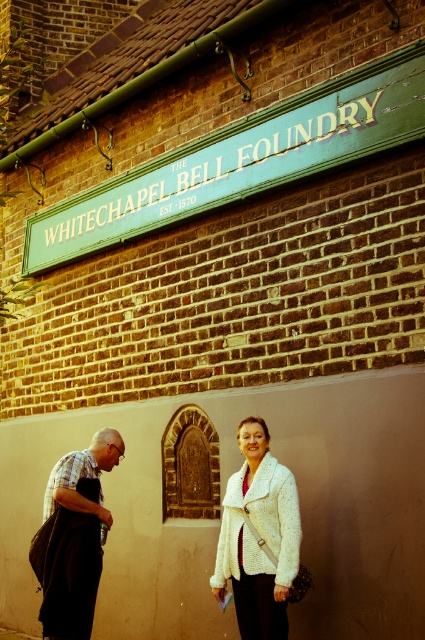
Who is lower down, white textured sweater at center or plaid shirt at left?

Positioned lower is plaid shirt at left.

Who is taller, white textured sweater at center or plaid shirt at left?

plaid shirt at left

Which is behind, point (65, 605) or point (45, 580)?

The point (45, 580) is behind.

I want to click on white textured sweater at center, so [73, 541].

Does green painted wood sign at upper center appear over white fluffy coat at lower center?

Correct, green painted wood sign at upper center is located above white fluffy coat at lower center.

Can you confirm if green painted wood sign at upper center is positioned to the right of white fluffy coat at lower center?

Incorrect, green painted wood sign at upper center is not on the right side of white fluffy coat at lower center.

What do you see at coordinates (240, 161) in the screenshot? I see `green painted wood sign at upper center` at bounding box center [240, 161].

Image resolution: width=425 pixels, height=640 pixels. Identify the location of green painted wood sign at upper center. tap(240, 161).

Is white textured sweater at center to the left of white fluffy coat at lower center from the viewer's perspective?

Indeed, white textured sweater at center is positioned on the left side of white fluffy coat at lower center.

Which of these two, white textured sweater at center or white fluffy coat at lower center, stands taller?

white textured sweater at center

Where is `white textured sweater at center`? white textured sweater at center is located at coordinates (73, 541).

What are the coordinates of `white textured sweater at center` in the screenshot? It's located at (73, 541).